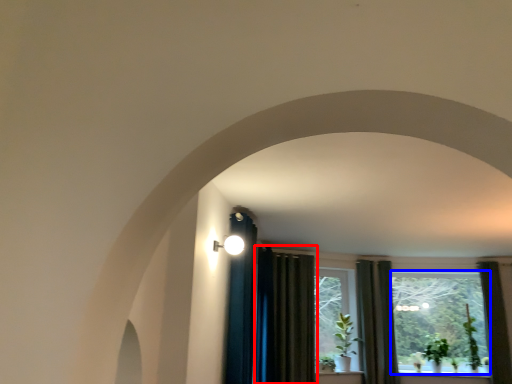
Question: Which object is closer to the camera taking this photo, curtain (highlighted by a red box) or window screen (highlighted by a blue box)?

Choices:
 (A) curtain
 (B) window screen

Answer: (A)